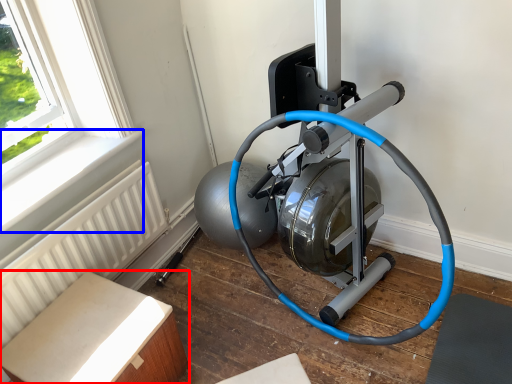
Question: Which object appears farthest to the camera in this image, furniture (highlighted by a red box) or window sill (highlighted by a blue box)?

Choices:
 (A) furniture
 (B) window sill

Answer: (B)